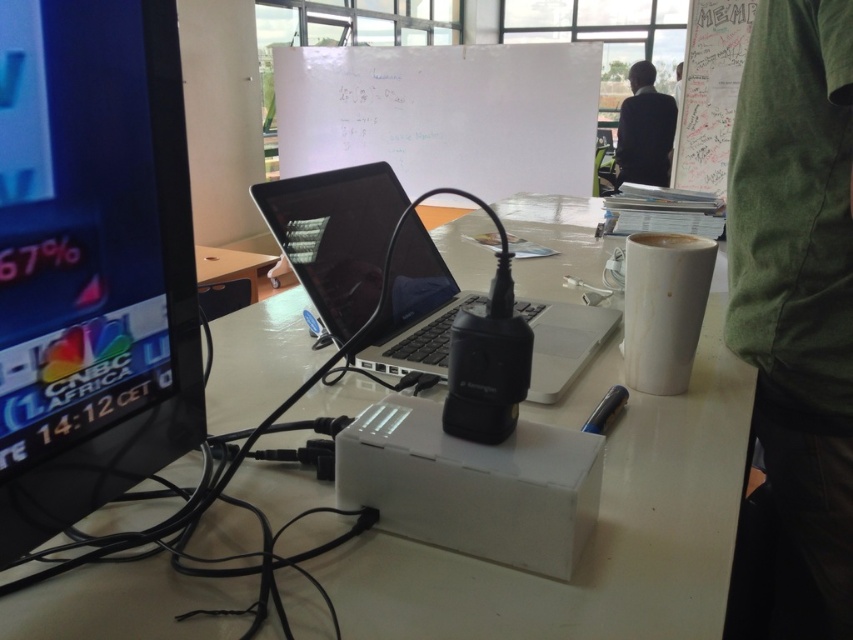
Who is more forward, (815, 166) or (380, 248)?

Point (815, 166) is more forward.

Does green cotton shirt at upper right have a greater height compared to sleek black laptop at center?

Indeed, green cotton shirt at upper right has a greater height compared to sleek black laptop at center.

Does point (764, 346) come farther from viewer compared to point (447, 301)?

No, it is not.

Identify the location of green cotton shirt at upper right. (798, 296).

Can you confirm if white plastic table at center is smaller than matte black monitor at left?

Incorrect, white plastic table at center is not smaller in size than matte black monitor at left.

Between point (672, 577) and point (184, 211), which one is positioned behind?

Positioned behind is point (184, 211).

Between point (428, 636) and point (54, 28), which one is positioned behind?

The point (428, 636) is more distant.

Locate an element on the screen. The height and width of the screenshot is (640, 853). white plastic table at center is located at coordinates pyautogui.click(x=592, y=534).

Between white plastic table at center and sleek black laptop at center, which one has less height?

With less height is sleek black laptop at center.

Who is more distant from viewer, (613, 573) or (315, 209)?

The point (315, 209) is behind.

Measure the distance between point (265, 300) and camera.

Point (265, 300) and camera are 1.20 meters apart.

You are a GUI agent. You are given a task and a screenshot of the screen. Output one action in this format:
    pyautogui.click(x=<x>, y=<y>)
    Task: Click on the white plastic table at center
    Image resolution: width=853 pixels, height=640 pixels.
    Given the screenshot: What is the action you would take?
    pyautogui.click(x=592, y=534)